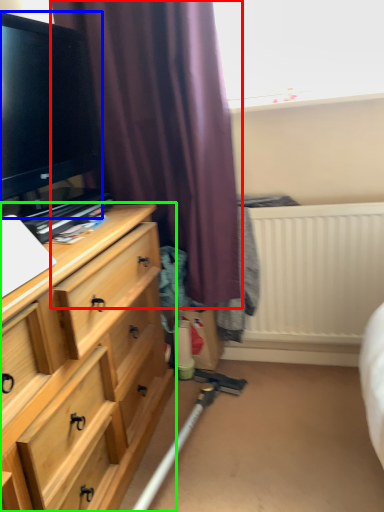
Question: Considering the real-world distances, which object is farthest from curtain (highlighted by a red box)? television (highlighted by a blue box) or chest of drawers (highlighted by a green box)?

Choices:
 (A) television
 (B) chest of drawers

Answer: (B)